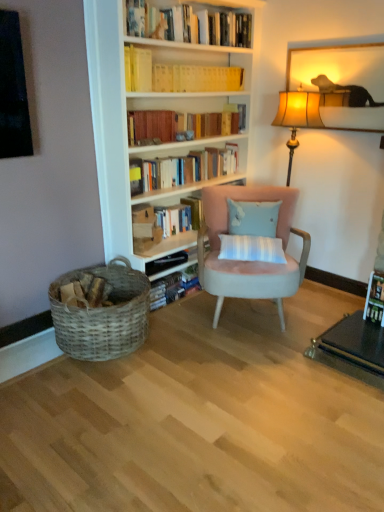
Locate an element on the screen. This screenshot has height=512, width=384. free space between suede pink armchair at center and woven wood basket at lower left is located at coordinates (185, 339).